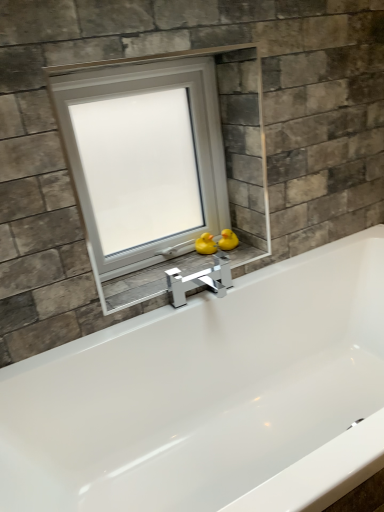
Where is `free space in front of yellow rubber duck at center, acting as the 2th duck starting from the left`? free space in front of yellow rubber duck at center, acting as the 2th duck starting from the left is located at coordinates (227, 260).